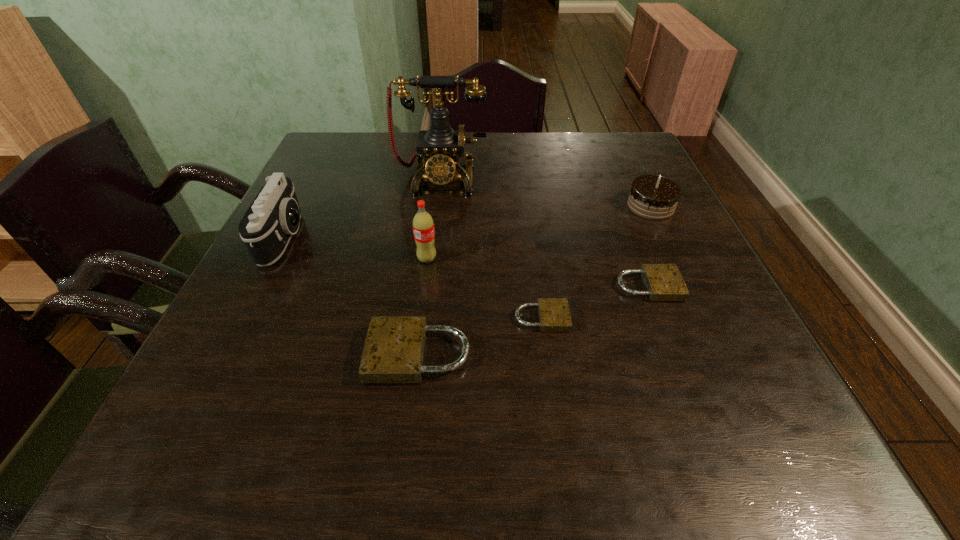
You are a GUI agent. You are given a task and a screenshot of the screen. Output one action in this format:
    pyautogui.click(x=<x>, y=<y>)
    Task: Click on the free space between the fifth object from left to right and the fourth tallest object
    The height and width of the screenshot is (540, 960).
    Given the screenshot: What is the action you would take?
    pyautogui.click(x=596, y=262)

Where is `empty space between the tallest padlock and the telephone`? empty space between the tallest padlock and the telephone is located at coordinates (430, 267).

This screenshot has width=960, height=540. Find the location of `free space between the soda and the camera`. free space between the soda and the camera is located at coordinates (356, 248).

At what (x,y) coordinates should I click in order to perform the action: click on empty space between the second padlock from left to right and the second tallest padlock. Please return your answer as a coordinate pair (x, y). This screenshot has width=960, height=540. Looking at the image, I should click on (595, 302).

Identify the location of vacant space in between the leftmost object and the tallest object. This screenshot has width=960, height=540. (363, 209).

The width and height of the screenshot is (960, 540). Identify the location of free area in between the camera and the chocolate cake. (468, 222).

Find the location of a particular element. vacant space that is in between the second shortest padlock and the fourth shortest object is located at coordinates (649, 246).

This screenshot has height=540, width=960. I want to click on free space between the second shortest padlock and the fifth object from left to right, so click(595, 302).

I want to click on empty space that is in between the second padlock from right to left and the telephone, so point(492,249).

This screenshot has width=960, height=540. I want to click on vacant area that lies between the soda and the fifth tallest object, so click(423, 307).